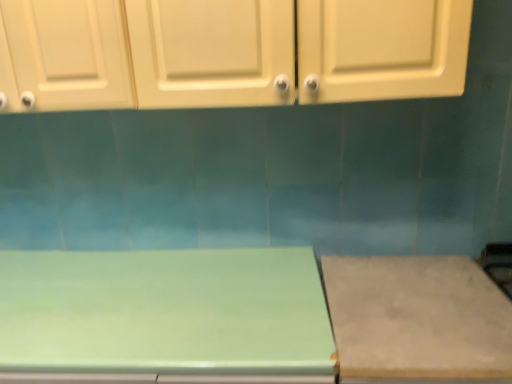
This screenshot has height=384, width=512. What do you see at coordinates (164, 317) in the screenshot?
I see `green glossy table at center` at bounding box center [164, 317].

You are a GUI agent. You are given a task and a screenshot of the screen. Output one action in this format:
    pyautogui.click(x=<x>, y=<y>)
    Task: Click on the green glossy table at center
    
    Given the screenshot: What is the action you would take?
    click(164, 317)

Find the location of a particular element. The width and height of the screenshot is (512, 384). green glossy table at center is located at coordinates (164, 317).